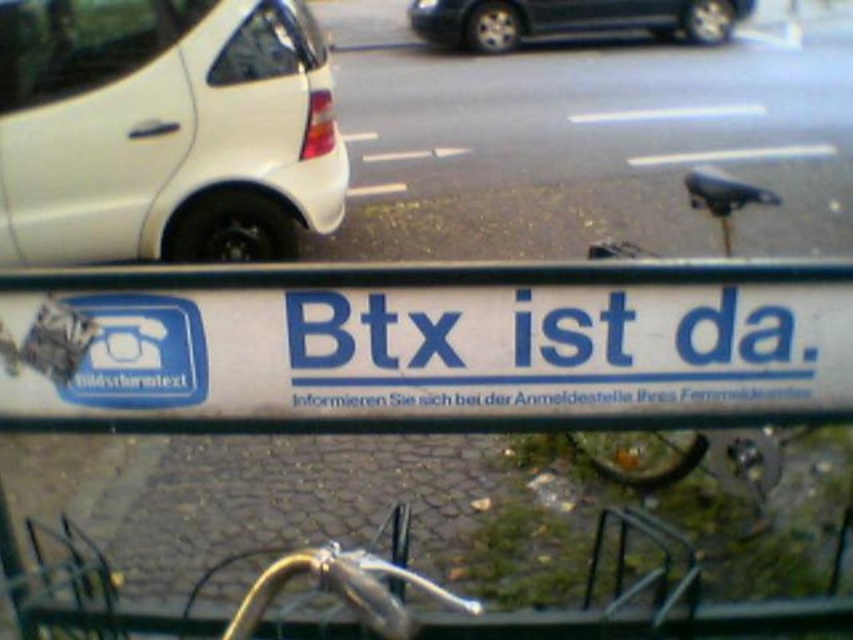
You are a delivery driver who needs to park your vehicle next to the white plastic sign at center and the white matte car at left. Based on the scene, which object would require more space to park next to?

The white matte car at left requires more space to park next to because it is larger than the white plastic sign at center according to the description.

You are a pedestrian standing in front of the reflective surface. You see the white plastic sign at center and the white matte car at left. Which object is closer to you?

The white plastic sign at center is closer to you because it is positioned under the white matte car at left, indicating it is in front of the car relative to your viewpoint.

You are a delivery driver who needs to park your vehicle between the white plastic sign at center and the black glossy car at upper center. Given that your delivery van is 2.5 meters wide, can you safely park there without overlapping either object?

The white plastic sign at center has a width less than the black glossy car at upper center. However, the exact width of the space between them isn